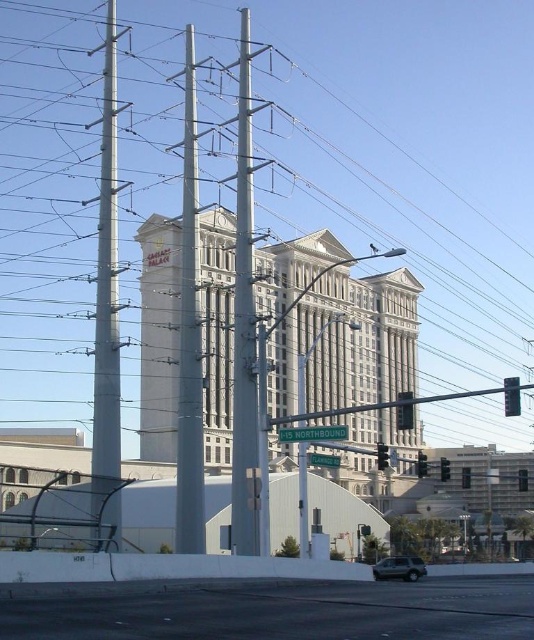
Question: Which object is the farthest from the white plastic power line at center?

Choices:
 (A) metallic silver traffic light at center
 (B) white marble tower at center
 (C) white marble building at center

Answer: (A)

Question: Which point is farther from the camera taking this photo?

Choices:
 (A) (464, 483)
 (B) (209, 349)

Answer: (B)

Question: Is green metallic street sign at center positioned before metallic traffic light at center right?

Choices:
 (A) yes
 (B) no

Answer: (A)

Question: Where is green metallic street sign at center located in relation to red glass traffic light at center right in the image?

Choices:
 (A) above
 (B) below

Answer: (A)

Question: Is green metallic street sign at center positioned before black plastic traffic light at center?

Choices:
 (A) yes
 (B) no

Answer: (A)

Question: Estimate the real-world distances between objects in this image. Which object is farther from the red glass traffic light at center right?

Choices:
 (A) green glass traffic light at center
 (B) black plastic traffic light at center

Answer: (A)